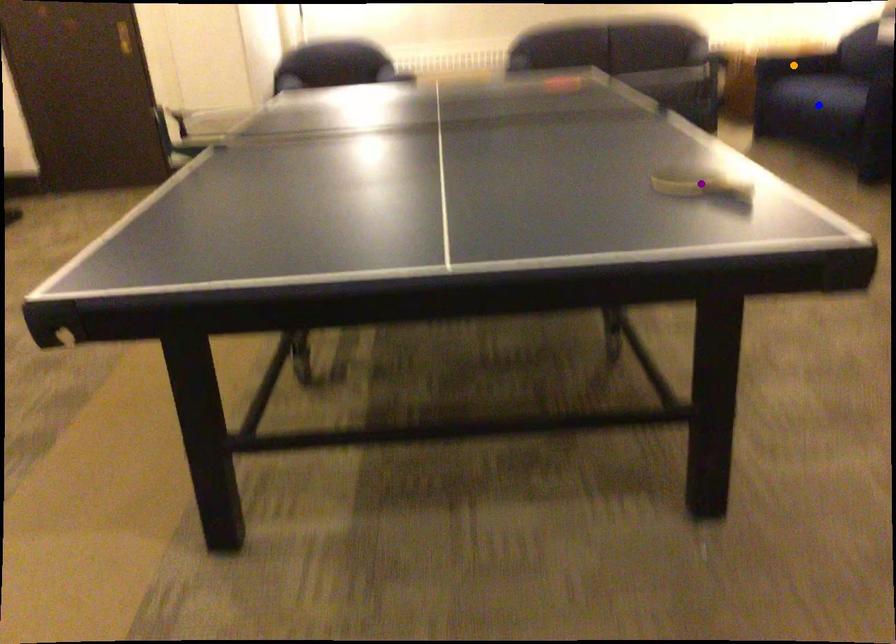
Order these from nearest to farthest:
blue point | orange point | purple point

orange point, blue point, purple point